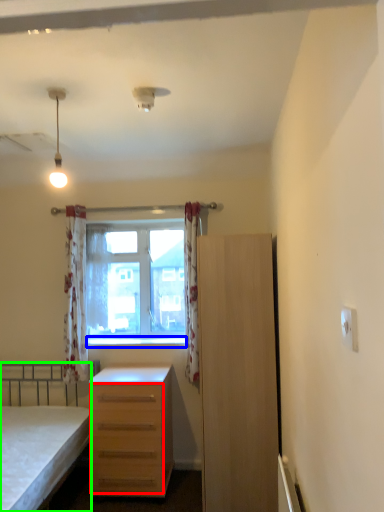
Question: Which object is the closest to the drawer (highlighted by a red box)? Choose among these: window sill (highlighted by a blue box) or bed (highlighted by a green box).

Choices:
 (A) window sill
 (B) bed

Answer: (B)